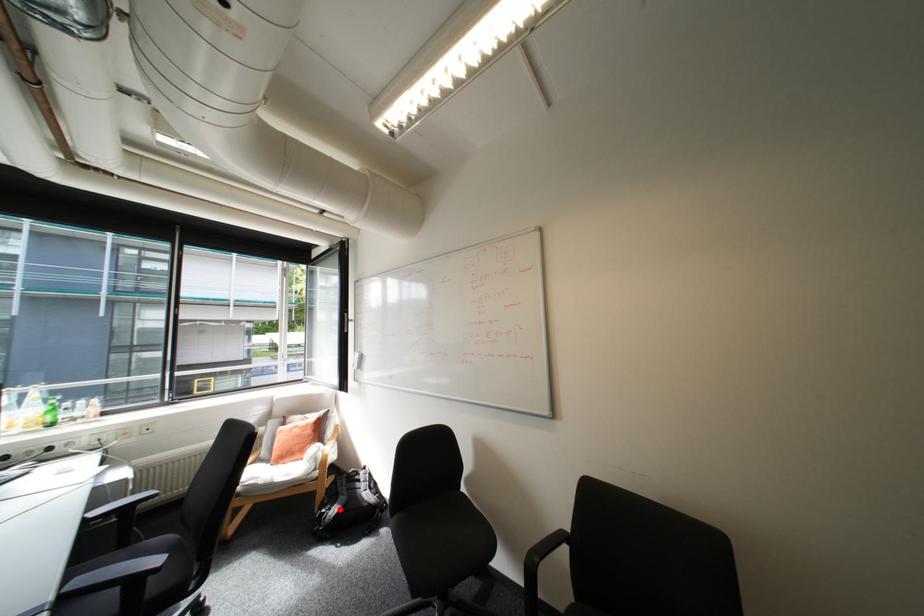
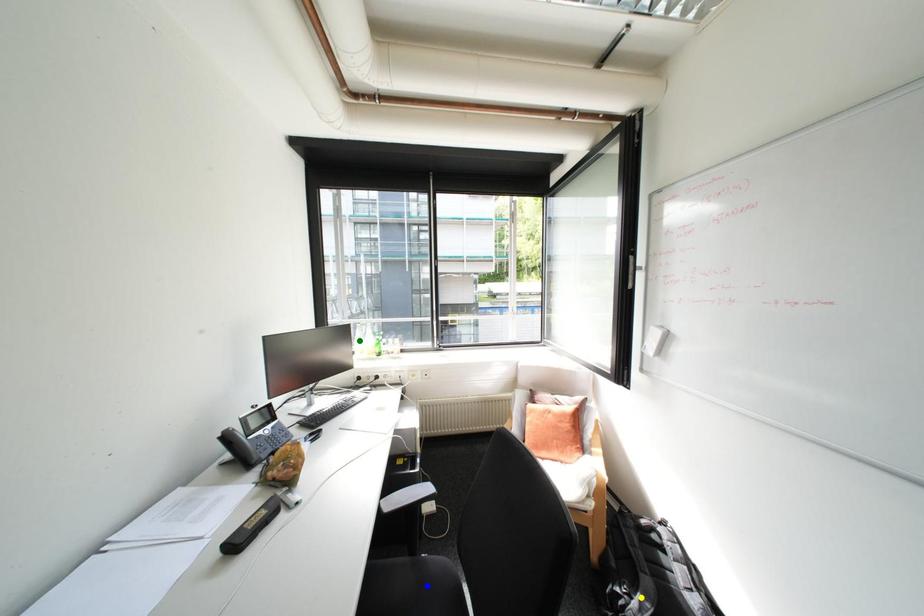
Question: I am providing you with two images of the same scene from different viewpoints. A red point is marked on the first image. You are given multiple points on the second image. Which spot in image 2 lines up with the point in image 1?

Choices:
 (A) yellow point
 (B) green point
 (C) blue point

Answer: (A)